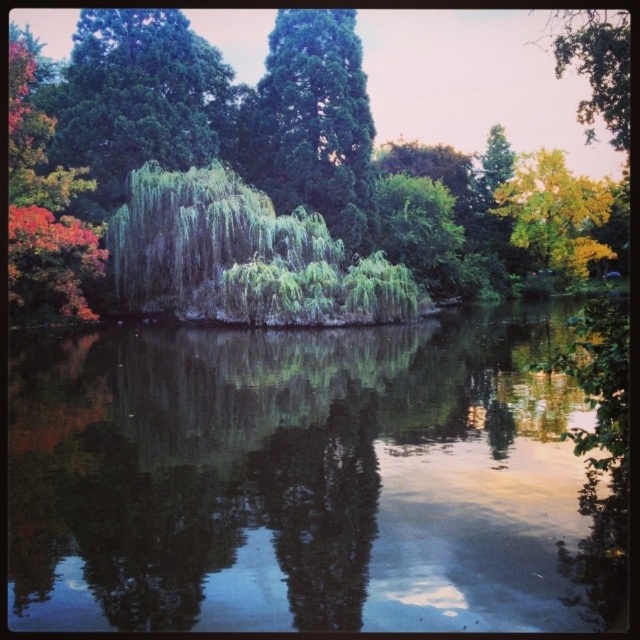
You are standing at the edge of the water and looking towards the green leafy willow at center and the green leafy tree at upper left. Which tree is closer to you?

The green leafy willow at center is closer to you because it is positioned below the green leafy tree at upper left, indicating it is in the midground while the other is further back.